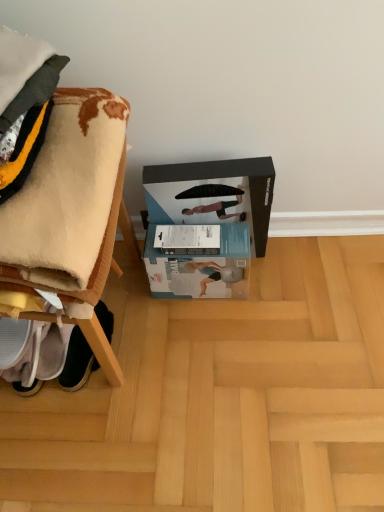
Identify the location of light brown wood at lower center. (221, 396).

The width and height of the screenshot is (384, 512). What do you see at coordinates (72, 223) in the screenshot? I see `white soft blanket at left` at bounding box center [72, 223].

Describe the element at coordinates (206, 225) in the screenshot. I see `black matte cardboard box at center` at that location.

What is the approximate height of black matte cardboard box at center?

13.86 inches.

Where is `white cardboard box at center`? The width and height of the screenshot is (384, 512). white cardboard box at center is located at coordinates (201, 268).

From a real-world perspective, which object rests below the other?

light brown wood at lower center.

Is light brown wood at lower center not inside white soft blanket at left?

Yes, light brown wood at lower center is located beyond the bounds of white soft blanket at left.

Is light brown wood at lower center turned away from white soft blanket at left?

That's not correct — light brown wood at lower center is not looking away from white soft blanket at left.

Which of these two, light brown wood at lower center or white soft blanket at left, is smaller?

light brown wood at lower center.

Is black matte cardboard box at center oriented towards white cardboard box at center?

Yes, black matte cardboard box at center is oriented towards white cardboard box at center.

Considering the sizes of objects black matte cardboard box at center and white cardboard box at center in the image provided, who is thinner, black matte cardboard box at center or white cardboard box at center?

With smaller width is black matte cardboard box at center.

Are black matte cardboard box at center and white cardboard box at center located far from each other?

black matte cardboard box at center is actually quite close to white cardboard box at center.

Considering the positions of objects black matte cardboard box at center and white cardboard box at center in the image provided, who is more to the right, black matte cardboard box at center or white cardboard box at center?

black matte cardboard box at center is more to the right.

What's the angular difference between white soft blanket at left and light brown wood at lower center's facing directions?

179 degrees.

Which object is wider, white soft blanket at left or light brown wood at lower center?

Wider between the two is light brown wood at lower center.

Considering the positions of objects white soft blanket at left and light brown wood at lower center in the image provided, who is more to the left, white soft blanket at left or light brown wood at lower center?

white soft blanket at left.

From a real-world perspective, is white soft blanket at left physically above light brown wood at lower center?

Yes, from a real-world perspective, white soft blanket at left is above light brown wood at lower center.

Is black matte cardboard box at center completely or partially outside of white soft blanket at left?

Yes.

From the image's perspective, between black matte cardboard box at center and white soft blanket at left, which one is located above?

white soft blanket at left.

Considering the relative sizes of black matte cardboard box at center and white soft blanket at left in the image provided, is black matte cardboard box at center shorter than white soft blanket at left?

Incorrect, the height of black matte cardboard box at center does not fall short of that of white soft blanket at left.

Between point (121, 137) and point (233, 287), which one is positioned behind?

The point (233, 287) is more distant.

Consider the image. From a real-world perspective, is white soft blanket at left positioned under white cardboard box at center based on gravity?

Actually, white soft blanket at left is physically above white cardboard box at center in the real world.

Is white soft blanket at left touching white cardboard box at center?

No, white soft blanket at left is not with white cardboard box at center.

How different are the orientations of black matte cardboard box at center and white fabric shoe at lower left in degrees?

The angle between the facing direction of black matte cardboard box at center and the facing direction of white fabric shoe at lower left is 6.2 degrees.

Considering the relative sizes of black matte cardboard box at center and white fabric shoe at lower left in the image provided, is black matte cardboard box at center taller than white fabric shoe at lower left?

Correct, black matte cardboard box at center is much taller as white fabric shoe at lower left.

Is point (152, 221) closer to camera compared to point (75, 351)?

No, it is not.

Is black matte cardboard box at center far away from white fabric shoe at lower left?

black matte cardboard box at center is near white fabric shoe at lower left, not far away.

Is there a large distance between white fabric shoe at lower left and black matte cardboard box at center?

No.

Considering the relative sizes of white fabric shoe at lower left and black matte cardboard box at center in the image provided, is white fabric shoe at lower left shorter than black matte cardboard box at center?

Correct, white fabric shoe at lower left is not as tall as black matte cardboard box at center.

From the image's perspective, which one is positioned higher, white fabric shoe at lower left or black matte cardboard box at center?

black matte cardboard box at center, from the image's perspective.

Find the location of `wood that is on the right side of white soft blanket at left`. wood that is on the right side of white soft blanket at left is located at coordinates (221, 396).

The width and height of the screenshot is (384, 512). What are the coordinates of `cardboard box above the white cardboard box at center (from the image's perspective)` in the screenshot? It's located at (206, 225).

Which object lies nearer to the anchor point white soft blanket at left, black matte cardboard box at center or white cardboard box at center?

black matte cardboard box at center is closer to white soft blanket at left.

From the image, which object appears to be farther from light brown wood at lower center, black matte cardboard box at center or white soft blanket at left?

Among the two, white soft blanket at left is located further to light brown wood at lower center.

Considering their positions, is white cardboard box at center positioned closer to white fabric shoe at lower left than black matte cardboard box at center?

white cardboard box at center is positioned closer to the anchor white fabric shoe at lower left.

Looking at the image, which one is located closer to white fabric shoe at lower left, light brown wood at lower center or white soft blanket at left?

white soft blanket at left lies closer to white fabric shoe at lower left than the other object.

From the image, which object appears to be farther from black matte cardboard box at center, white fabric shoe at lower left or white soft blanket at left?

Among the two, white fabric shoe at lower left is located further to black matte cardboard box at center.

Based on the photo, estimate the real-world distances between objects in this image. Which object is closer to white fabric shoe at lower left, white cardboard box at center or light brown wood at lower center?

white cardboard box at center is positioned closer to the anchor white fabric shoe at lower left.

Considering their positions, is white cardboard box at center positioned further to black matte cardboard box at center than white fabric shoe at lower left?

white fabric shoe at lower left.

Which object lies nearer to the anchor point white cardboard box at center, white fabric shoe at lower left or white soft blanket at left?

white fabric shoe at lower left is positioned closer to the anchor white cardboard box at center.

The height and width of the screenshot is (512, 384). What are the coordinates of `box between white fabric shoe at lower left and black matte cardboard box at center in the horizontal direction` in the screenshot? It's located at (201, 268).

Where is `box between black matte cardboard box at center and light brown wood at lower center vertically`? box between black matte cardboard box at center and light brown wood at lower center vertically is located at coordinates (201, 268).

I want to click on wood between white soft blanket at left and white fabric shoe at lower left along the z-axis, so click(x=221, y=396).

Where is `wood between white soft blanket at left and white cardboard box at center from front to back`? Image resolution: width=384 pixels, height=512 pixels. wood between white soft blanket at left and white cardboard box at center from front to back is located at coordinates (x=221, y=396).